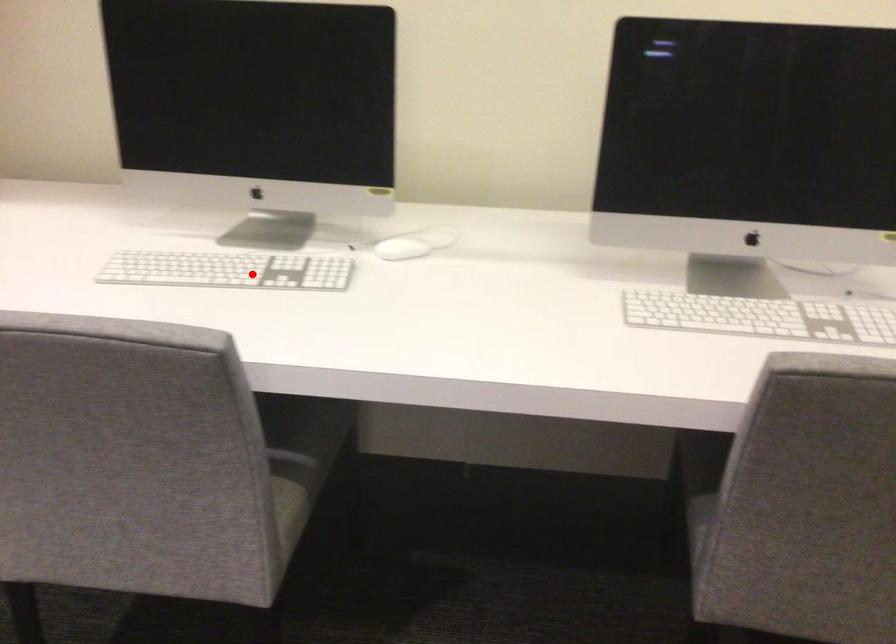
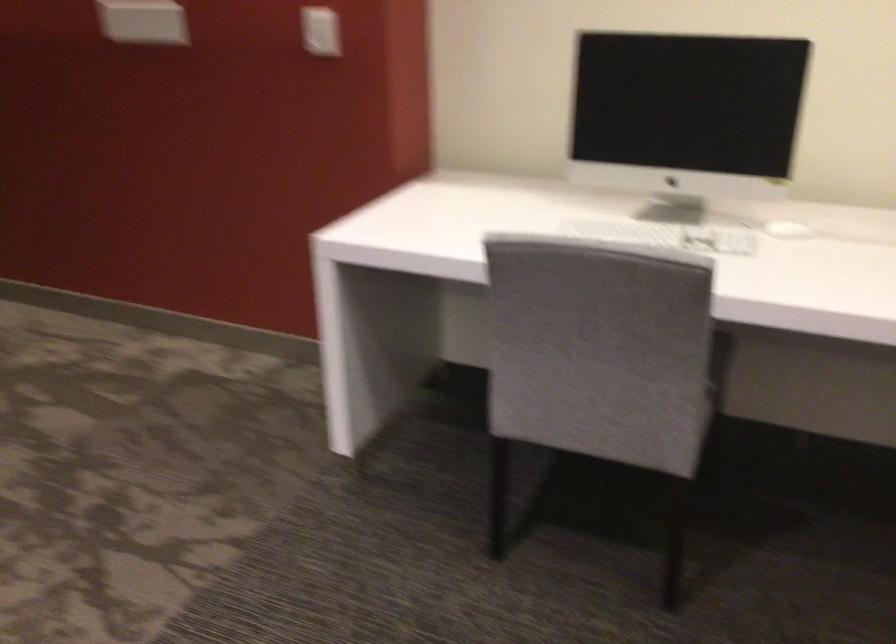
In the second image, find the point that corresponds to the highlighted location in the first image.

(666, 234)